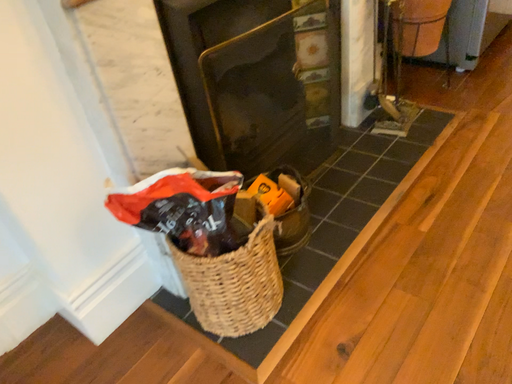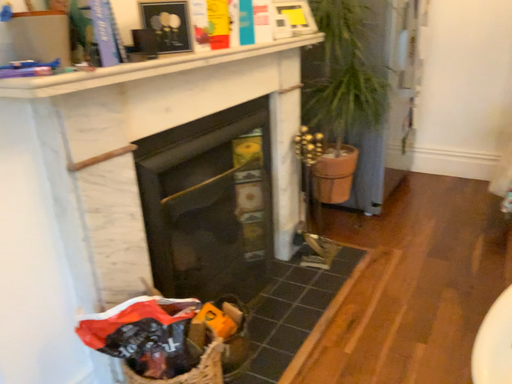
Question: Which way did the camera rotate in the video?

Choices:
 (A) rotated left
 (B) rotated right

Answer: (B)